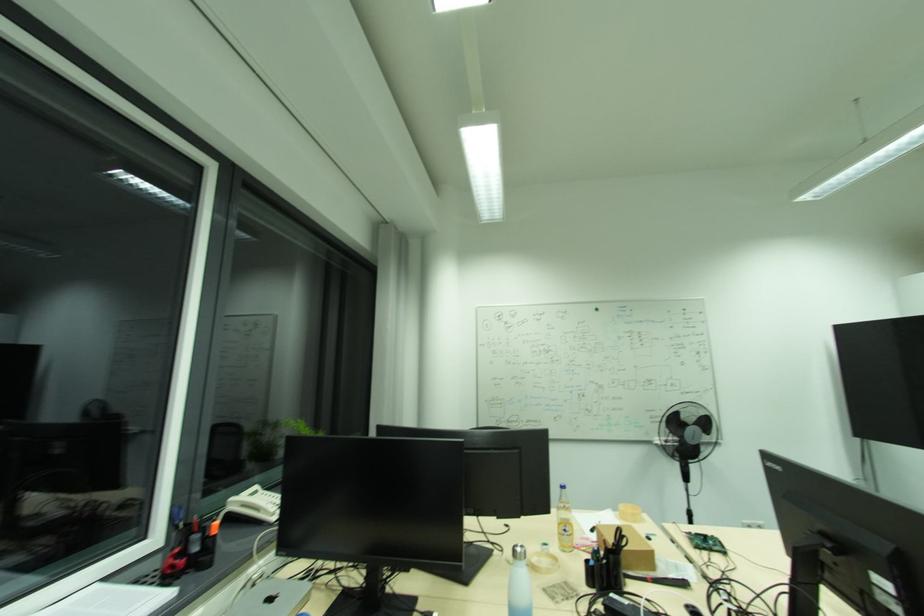
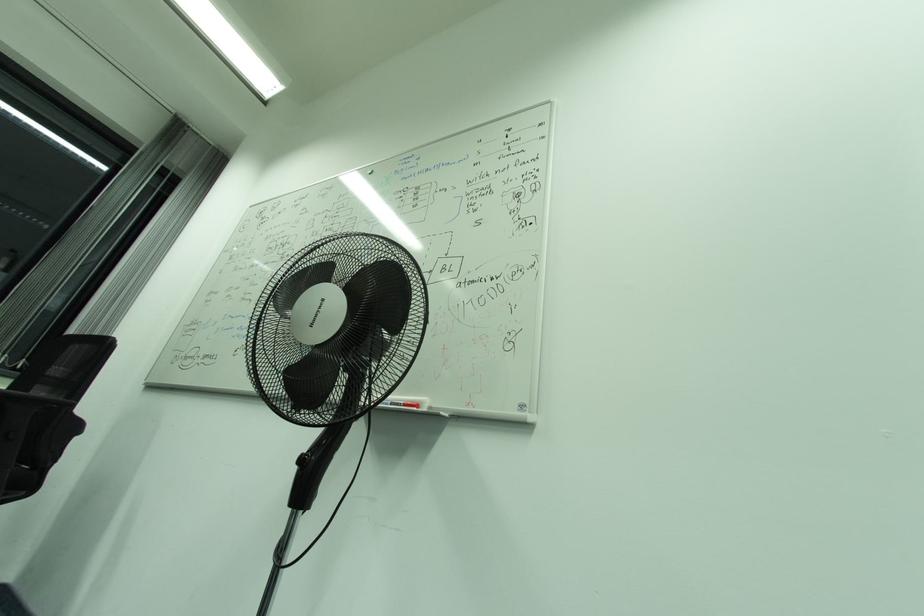
Which direction would the cameraman need to move to produce the second image?

The cameraman walked toward right, forward.